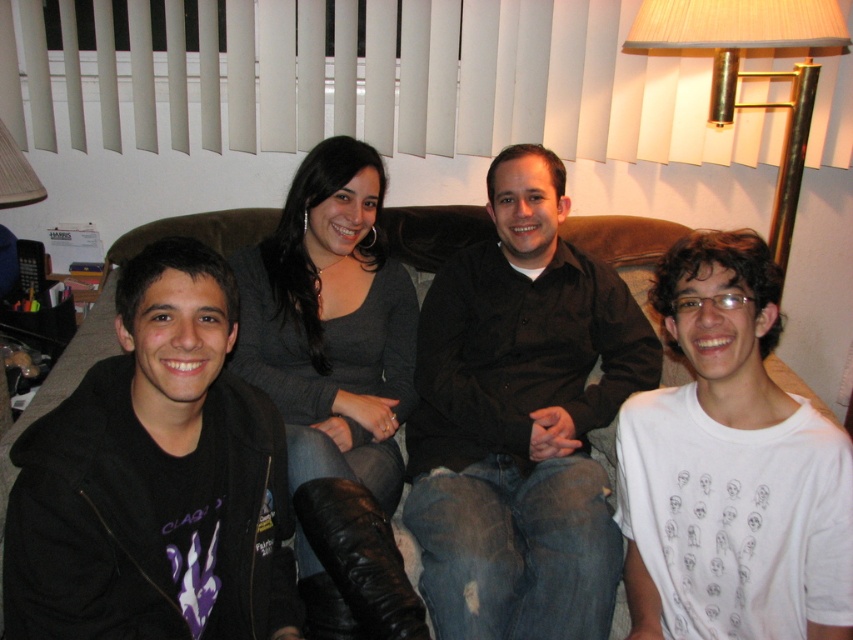
Is brown fabric couch at center bigger than gold metallic lampshade at upper right?

Yes, brown fabric couch at center is bigger than gold metallic lampshade at upper right.

Is brown fabric couch at center positioned before gold metallic lampshade at upper right?

Yes, it is.

This screenshot has height=640, width=853. I want to click on brown fabric couch at center, so click(x=113, y=314).

Identify the location of brown fabric couch at center. Image resolution: width=853 pixels, height=640 pixels. (113, 314).

Which is in front, point (44, 499) or point (804, 90)?

Point (44, 499)

Is black fleece jacket at lower left taller than gold metallic lampshade at upper right?

Correct, black fleece jacket at lower left is much taller as gold metallic lampshade at upper right.

Describe the element at coordinates (155, 480) in the screenshot. I see `black fleece jacket at lower left` at that location.

Identify the location of black fleece jacket at lower left. (155, 480).

Between black matte shirt at center and gold metallic lampshade at upper right, which one is positioned higher?

gold metallic lampshade at upper right

At what (x,y) coordinates should I click in order to perform the action: click on black matte shirt at center. Please return your answer as a coordinate pair (x, y). The height and width of the screenshot is (640, 853). Looking at the image, I should click on (520, 420).